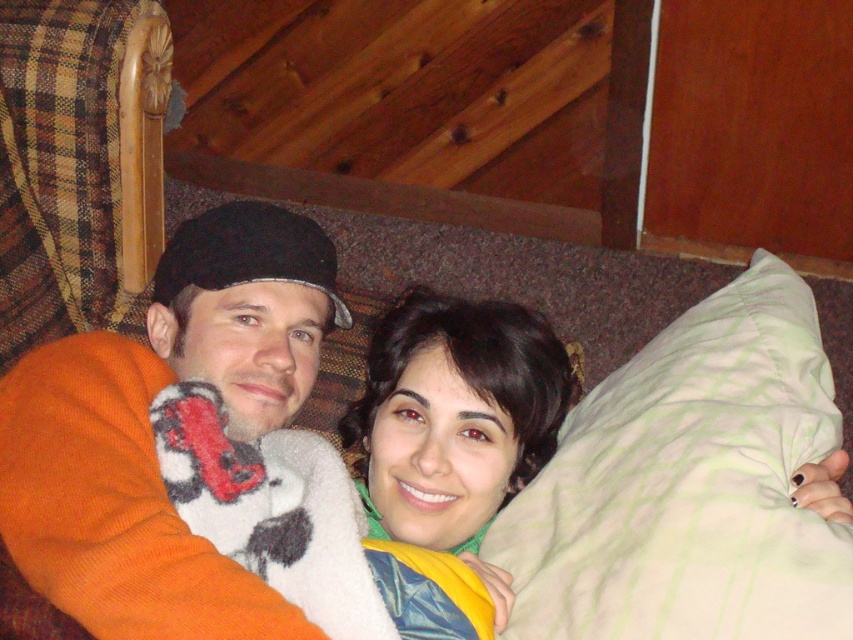
Question: Which point appears farthest from the camera in this image?

Choices:
 (A) (729, 516)
 (B) (4, 538)
 (C) (527, 376)
 (D) (38, 477)

Answer: (C)

Question: Can you confirm if orange fuzzy sweater at left is positioned to the right of dark brown hair at center?

Choices:
 (A) yes
 (B) no

Answer: (B)

Question: Is the position of orange knit sweater at center more distant than that of dark brown hair at center?

Choices:
 (A) no
 (B) yes

Answer: (A)

Question: Based on their relative distances, which object is nearer to the green striped pillow at lower right?

Choices:
 (A) dark brown hair at center
 (B) orange fuzzy sweater at left

Answer: (A)

Question: Which is farther from the orange fuzzy sweater at left?

Choices:
 (A) dark brown hair at center
 (B) orange knit sweater at center
 (C) green striped pillow at lower right

Answer: (C)

Question: Does green striped pillow at lower right appear over dark brown hair at center?

Choices:
 (A) yes
 (B) no

Answer: (A)